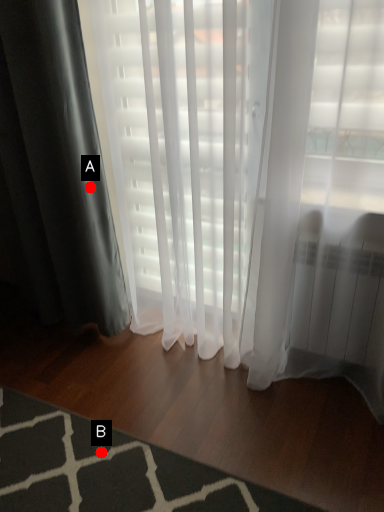
Question: Two points are circled on the image, labeled by A and B beside each circle. Which of the following is the farthest from the observer?

Choices:
 (A) A is further
 (B) B is further

Answer: (A)